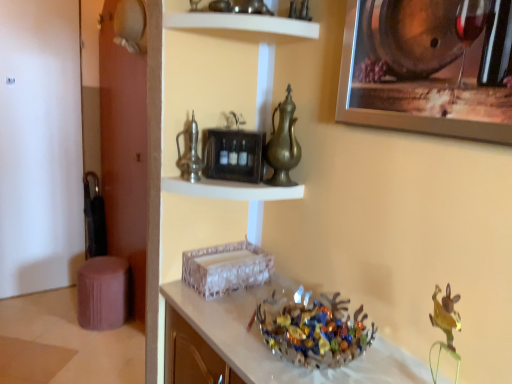
Where is `vacant space positioned to the left of shiny metallic bowl at center`? vacant space positioned to the left of shiny metallic bowl at center is located at coordinates (225, 324).